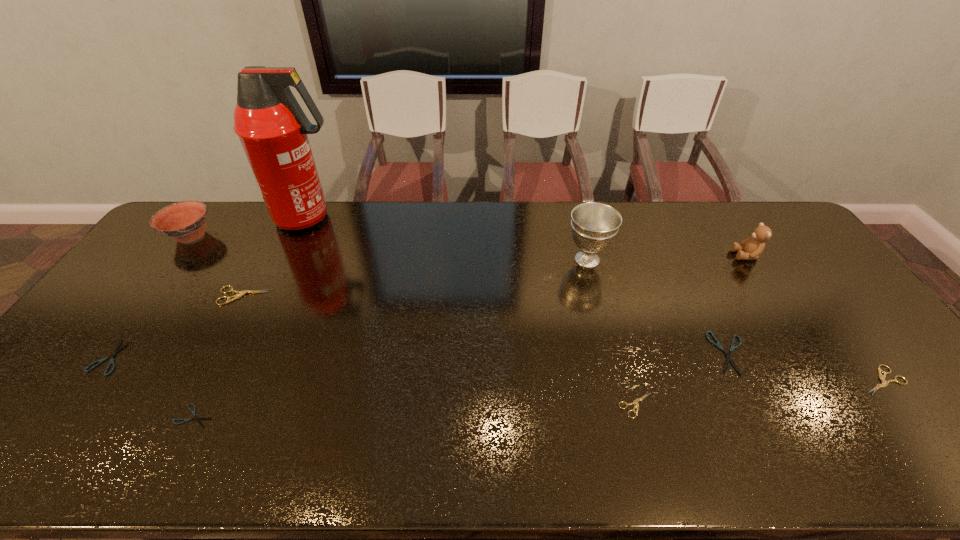
You are a GUI agent. You are given a task and a screenshot of the screen. Output one action in this format:
    pyautogui.click(x=<x>, y=<y>)
    Task: Click on the biggest black shears
    This screenshot has width=960, height=540.
    Given the screenshot: What is the action you would take?
    pyautogui.click(x=728, y=355)

The height and width of the screenshot is (540, 960). What are the coordinates of `the rightmost black shears` in the screenshot? It's located at pos(728,355).

The image size is (960, 540). Identify the location of the fourth shears from left to right. (635, 402).

Identify the location of the second beige shears from left to right. (635, 402).

Where is `the leftmost black shears`? The width and height of the screenshot is (960, 540). the leftmost black shears is located at coordinates (116, 350).

Locate an element on the screen. This screenshot has height=540, width=960. the second biggest black shears is located at coordinates (116, 350).

Where is `the shortest object`? Image resolution: width=960 pixels, height=540 pixels. the shortest object is located at coordinates (196, 418).

Locate an element on the screen. The image size is (960, 540). the shortest shears is located at coordinates (196, 418).

The width and height of the screenshot is (960, 540). I want to click on vacant space positioned 0.240m on the trigger side of the red fire extinguisher, so click(x=412, y=218).

What are the coordinates of `free spot located 0.310m on the right of the second tallest object` in the screenshot? It's located at (706, 260).